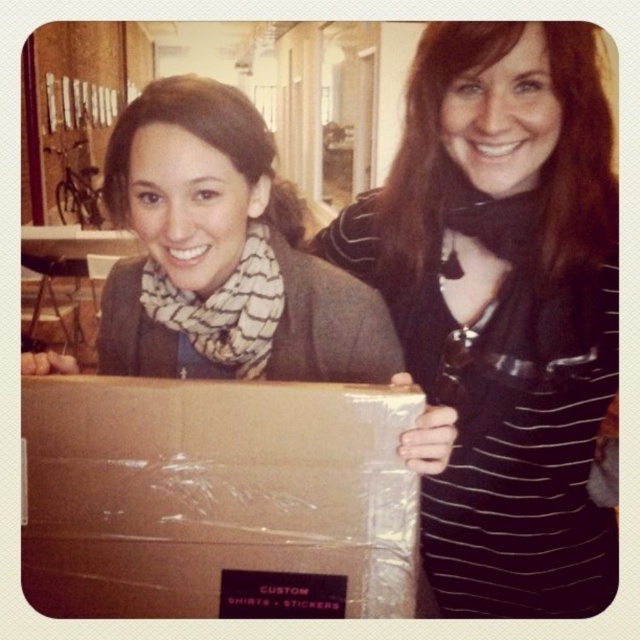
Consider the image. You are trying to decide which item to pick up first between the black striped shirt at center and the brown cardboard box at center. Which one is larger?

The black striped shirt at center is bigger than the brown cardboard box at center, so you should pick up the black striped shirt at center first.

You are standing in front of the two women in the image. There is a specific point at coordinates point (468, 522) that you need to reach. If you take a step forward of 3 feet, will you be closer to that point?

The distance between point (468, 522) and the viewer is 36.52 inches. Since 3 feet equals 36 inches, stepping forward by 3 feet would bring you to within 0.52 inches of the point, so yes, you will be closer to that point.

You are standing in the room where the two women are. You need to place a small plant between the two points marked as point (518, 596) and point (208, 600). Which point should the plant be closer to in order to be closer to the viewer?

The plant should be closer to point (518, 596) because it is closer to the viewer than point (208, 600).